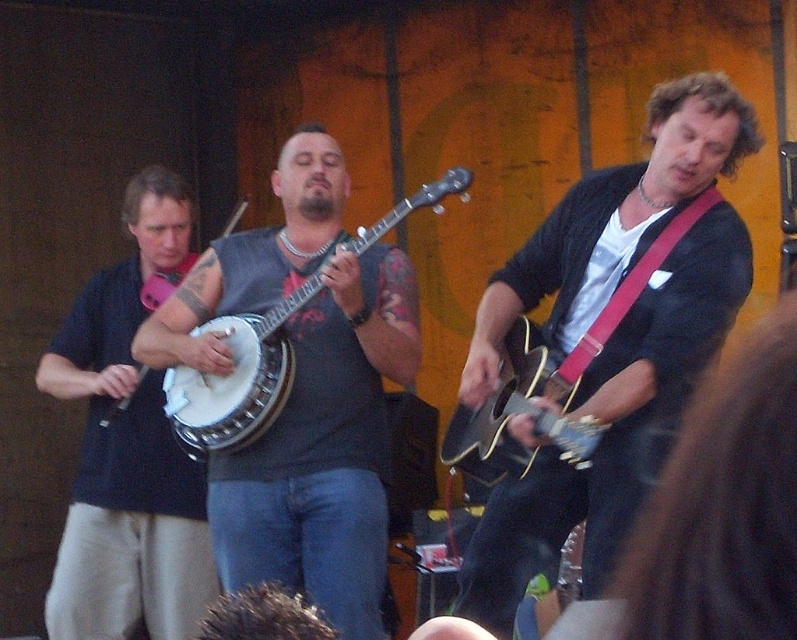
You are a photographer positioned at the front of the crowd. You want to take a photo focusing on the matte black guitar at center and the matte black banjo at center. Which instrument will appear larger in your photo?

The matte black guitar at center will appear larger in the photo because it is closer to the viewer than the matte black banjo at center.

You are a photographer at the event and want to capture a photo of both the matte black banjo at left and the matte wood banjo at center. Since you want both instruments to be clearly visible in the frame, which banjo should you focus on first to ensure the one in front is sharp?

The matte wood banjo at center is behind the matte black banjo at left, so you should focus on the matte black banjo at left first to ensure it is sharp, as it is in front and will be the primary subject in the frame.

You are standing in the crowd watching the live performance. There is a matte black banjo at left. Can you reach out and touch it from where you are standing?

The matte black banjo at left is 14.10 feet away from viewer. Since 14.10 feet is significantly farther than an average person can reach, you cannot touch it from where you are standing.